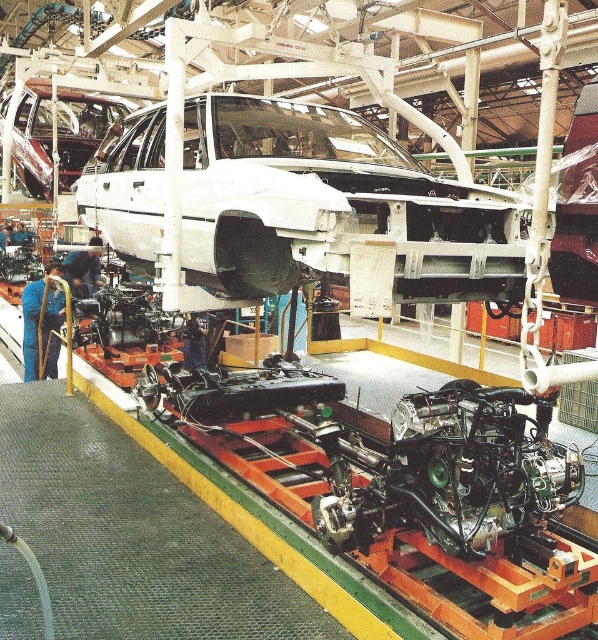
Question: Is white matte car at center further to camera compared to shiny chrome car at upper left?

Choices:
 (A) yes
 (B) no

Answer: (B)

Question: Which of the following is the closest to the observer?

Choices:
 (A) tap(102, 134)
 (B) tap(139, 243)

Answer: (B)

Question: Does white matte car at center have a larger size compared to shiny chrome car at upper left?

Choices:
 (A) no
 (B) yes

Answer: (A)

Question: Is white matte car at center wider than shiny chrome car at upper left?

Choices:
 (A) no
 (B) yes

Answer: (B)

Question: Which point is farther from the camera taking this photo?

Choices:
 (A) (65, 172)
 (B) (435, 227)

Answer: (A)